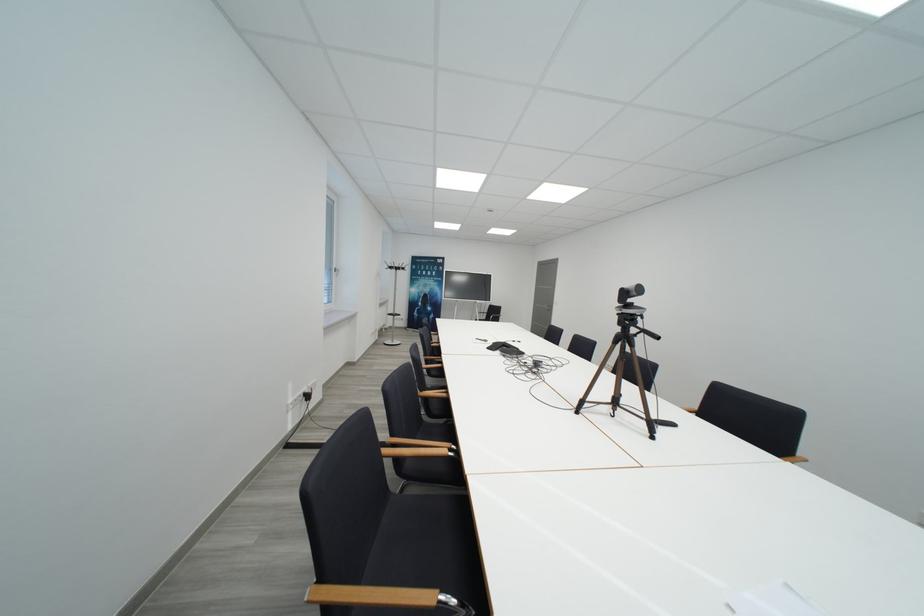
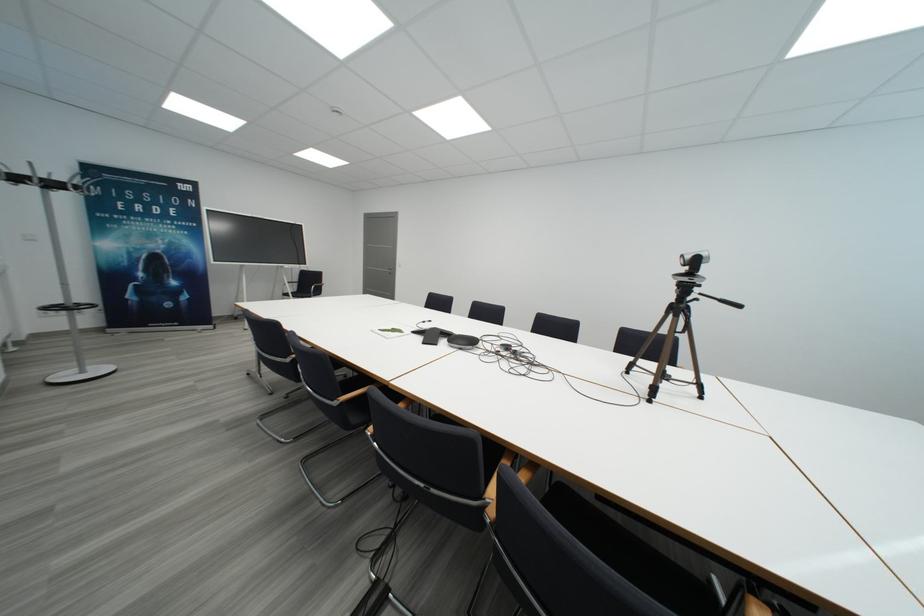
Locate, in the second image, the point that corresponds to the point at 397,270 in the first image.

(21, 180)